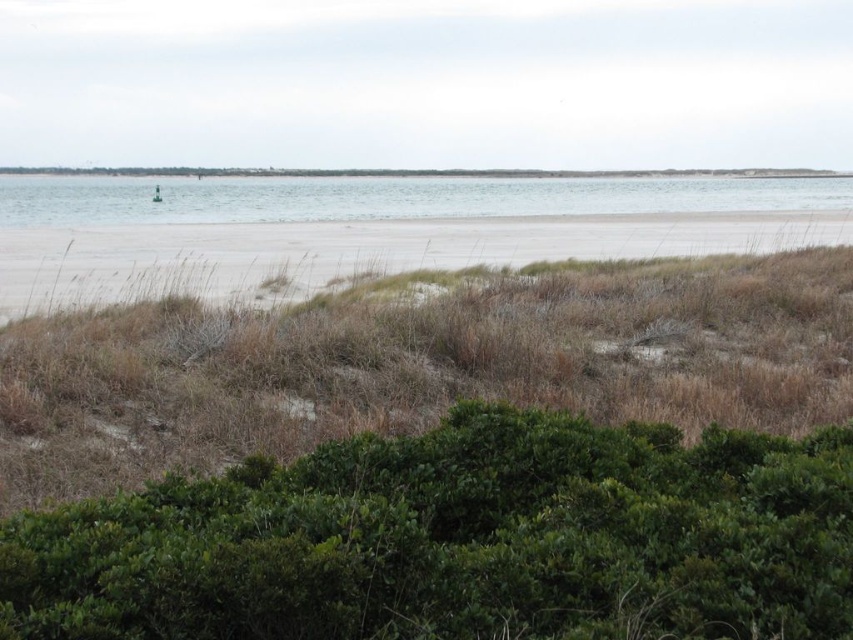
You are standing on the beach and want to walk to the clear water at center. There is a green leafy bush at lower center in your way. Can you walk around it easily?

The green leafy bush at lower center is thinner than clear water at center, so yes, you can walk around it easily since it is narrower than the clear water at center.

You are a hiker who wants to walk from the green leafy bush at lower center to the light beige sand at center. Based on the scene, can you determine if you will have to step over or under any obstacles between them?

The green leafy bush at lower center is in front of light beige sand at center, so there are no obstacles between them. You can walk directly from the green leafy bush at lower center to the light beige sand at center without needing to step over or under anything.

You are standing on the beach and see the green leafy bush at lower center and the clear water at center. Which object is closer to your current position?

The green leafy bush at lower center is closer to your current position because it is located below the clear water at center, meaning it is situated lower in the scene and thus nearer to the observer standing on the beach.